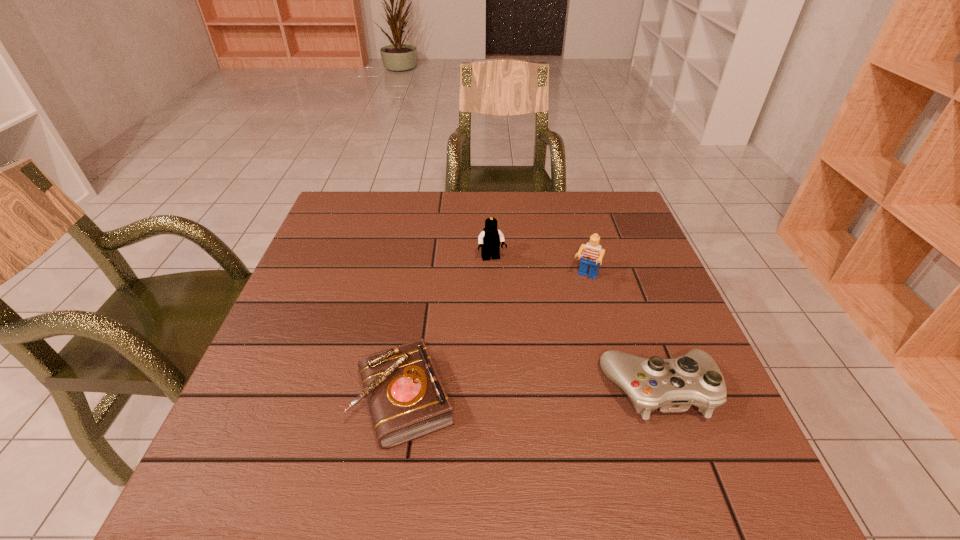
Identify the location of free space between the second farthest object and the third tallest object. (622, 335).

Identify the location of free space between the leftmost object and the nearer Lego. The image size is (960, 540). (495, 339).

Locate an element on the screen. The image size is (960, 540). empty location between the second shortest object and the diary is located at coordinates (533, 394).

Identify the location of empty space between the control and the farthest object. The height and width of the screenshot is (540, 960). (576, 325).

The height and width of the screenshot is (540, 960). What are the coordinates of `vacant space that is in between the farthest object and the nearer Lego` in the screenshot? It's located at (539, 269).

Identify which object is located as the second nearest to the nearer Lego. Please provide its 2D coordinates. Your answer should be formatted as a tuple, i.e. [(x, y)], where the tuple contains the x and y coordinates of a point satisfying the conditions above.

[(672, 385)]

Locate which object ranks third in proximity to the leftmost object. Please provide its 2D coordinates. Your answer should be formatted as a tuple, i.e. [(x, y)], where the tuple contains the x and y coordinates of a point satisfying the conditions above.

[(592, 256)]

What are the coordinates of `vacant region that satisfies the following two spatial constraints: 1. on the back side of the leftmost object; 2. on the right side of the nearer Lego` in the screenshot? It's located at (422, 279).

You are a GUI agent. You are given a task and a screenshot of the screen. Output one action in this format:
    pyautogui.click(x=<x>, y=<y>)
    Task: Click on the free region that satisfies the following two spatial constraints: 1. on the front side of the right Lego; 2. on the left side of the control
    This screenshot has height=540, width=960.
    Given the screenshot: What is the action you would take?
    (x=615, y=390)

You are a GUI agent. You are given a task and a screenshot of the screen. Output one action in this format:
    pyautogui.click(x=<x>, y=<y>)
    Task: Click on the vacant space that satisfies the following two spatial constraints: 1. on the front side of the third nearest object; 2. on the left side of the third tallest object
    
    Given the screenshot: What is the action you would take?
    pyautogui.click(x=615, y=390)